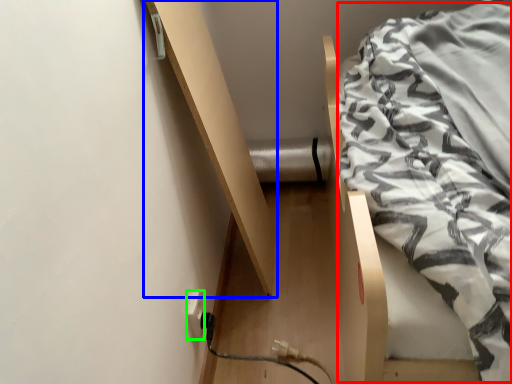
Question: Which object is positioned farthest from blanket (highlighted by a red box)? Select from shelf (highlighted by a blue box) and electric outlet (highlighted by a green box).

Choices:
 (A) shelf
 (B) electric outlet

Answer: (B)